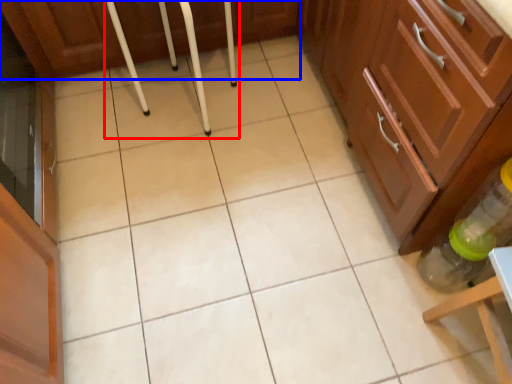
Question: Which of the following is the farthest to the observer, bar stool (highlighted by a red box) or cabinetry (highlighted by a blue box)?

Choices:
 (A) bar stool
 (B) cabinetry

Answer: (B)